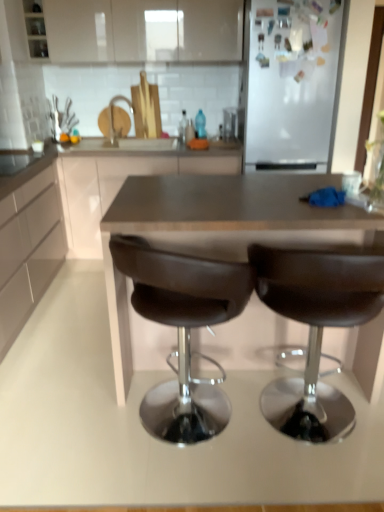
Locate an element on the screen. This screenshot has width=384, height=512. free spot in front of brown leather chair at center, which ranks as the 1th chair in left-to-right order is located at coordinates (186, 484).